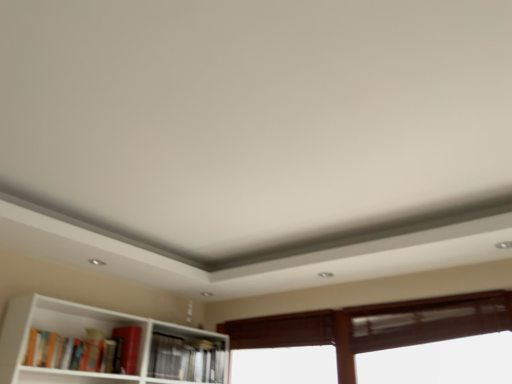
Question: Considering their positions, is brown wooden window at lower right located in front of or behind hardcover book at lower left, the 2th book viewed from the back?

Choices:
 (A) front
 (B) behind

Answer: (B)

Question: Is brown wooden window at lower right situated inside hardcover book at lower left, the 2th book viewed from the back, or outside?

Choices:
 (A) outside
 (B) inside

Answer: (A)

Question: Estimate the real-world distances between objects in this image. Which object is closer to the brown wooden window at lower right?

Choices:
 (A) hardcover book at lower left, the 2th book viewed from the back
 (B) hardcover book at center, the 2th book from the front

Answer: (B)

Question: Which is nearer to the hardcover book at center, acting as the 1th book starting from the right?

Choices:
 (A) hardcover book at lower left, the 2th book viewed from the back
 (B) brown wooden window at lower right

Answer: (A)